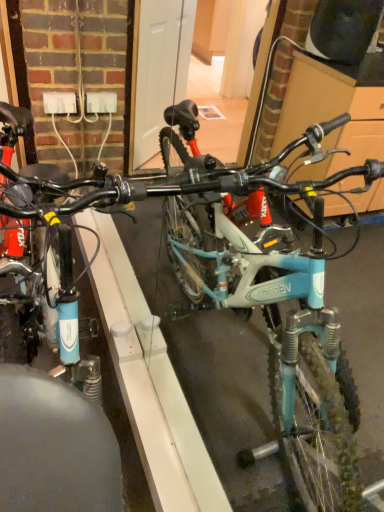
In order to click on matte blue bicycle at center in this screenshot , I will do `click(270, 295)`.

The width and height of the screenshot is (384, 512). What do you see at coordinates (270, 295) in the screenshot?
I see `matte blue bicycle at center` at bounding box center [270, 295].

The height and width of the screenshot is (512, 384). Find the location of `matte blue bicycle at center`. matte blue bicycle at center is located at coordinates (270, 295).